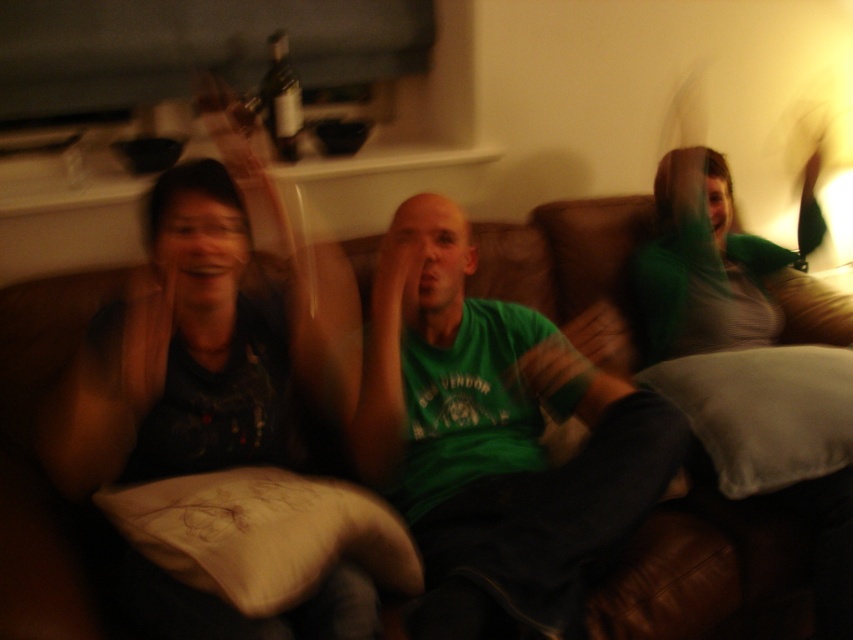
Between white soft pillow at lower left and green fabric pillow at right, which one appears on the left side from the viewer's perspective?

white soft pillow at lower left is more to the left.

From the picture: Between white soft pillow at lower left and green fabric pillow at right, which one appears on the right side from the viewer's perspective?

green fabric pillow at right is more to the right.

The image size is (853, 640). Describe the element at coordinates (262, 532) in the screenshot. I see `white soft pillow at lower left` at that location.

The width and height of the screenshot is (853, 640). I want to click on white soft pillow at lower left, so click(x=262, y=532).

Between point (506, 547) and point (624, 218), which one is positioned in front?

Positioned in front is point (506, 547).

Does green matte shirt at center have a greater height compared to brown leather couch at center?

Yes.

Is point (485, 440) positioned after point (749, 545)?

That is True.

The width and height of the screenshot is (853, 640). I want to click on green matte shirt at center, so click(x=492, y=435).

Does brown leather couch at center appear on the left side of white soft pillow at lower left?

Correct, you'll find brown leather couch at center to the left of white soft pillow at lower left.

Looking at this image, who is positioned more to the left, brown leather couch at center or white soft pillow at lower left?

brown leather couch at center is more to the left.

Identify the location of brown leather couch at center. (44, 476).